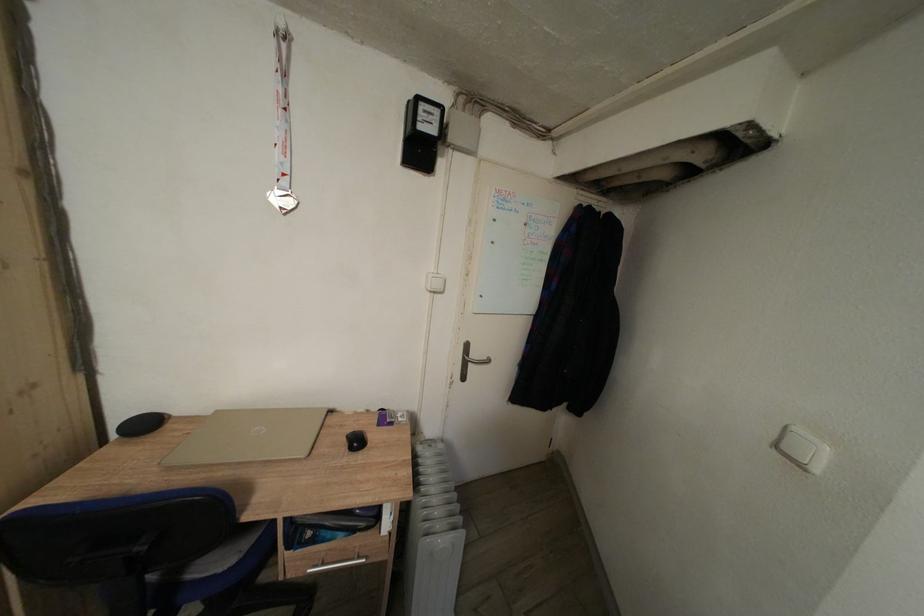
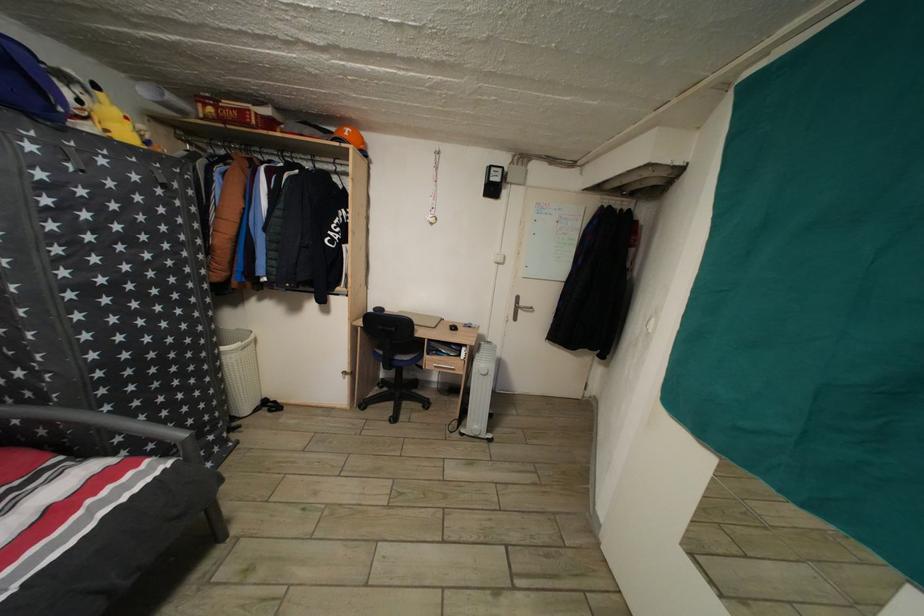
In the second image, find the point that corresponds to pixel 480 361 in the first image.

(529, 310)